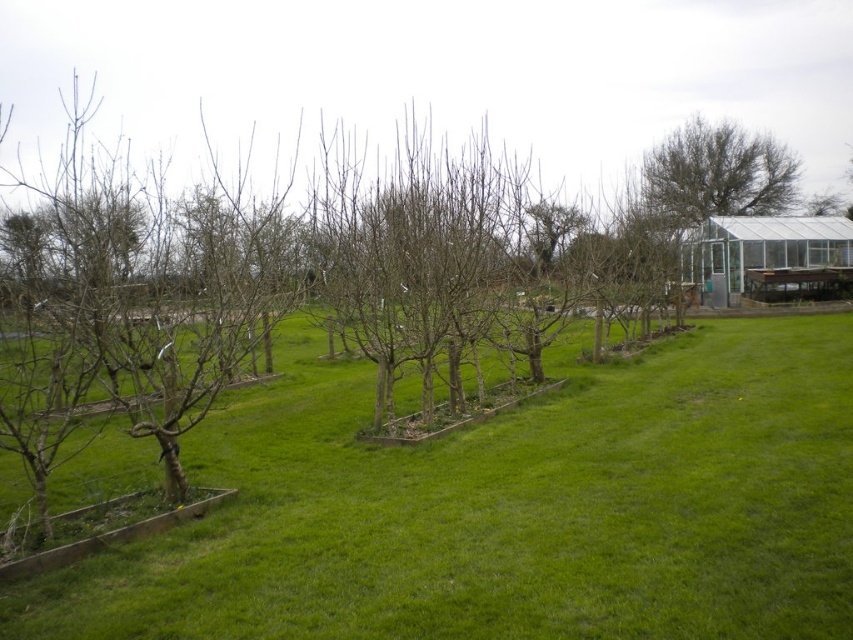
Question: In this image, where is green grassy at center located relative to green leafy tree at upper right?

Choices:
 (A) below
 (B) above

Answer: (A)

Question: Can you confirm if green grassy at center is positioned to the left of green leafy tree at upper right?

Choices:
 (A) yes
 (B) no

Answer: (A)

Question: Which object is farther from the camera taking this photo?

Choices:
 (A) green leafy tree at upper right
 (B) green grassy at center

Answer: (A)

Question: Can you confirm if green grassy at center is positioned to the left of green leafy tree at upper right?

Choices:
 (A) no
 (B) yes

Answer: (B)

Question: Which point appears farthest from the camera in this image?

Choices:
 (A) (695, 518)
 (B) (657, 214)

Answer: (B)